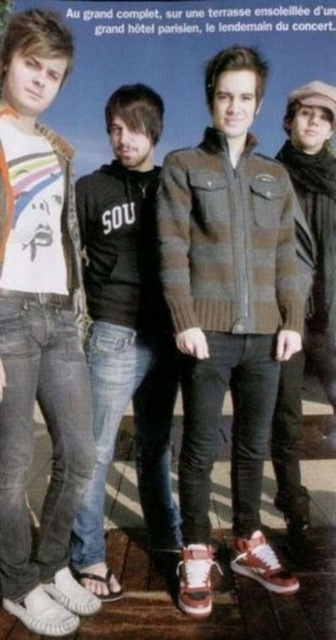
You are standing on the wooden deck and want to take a photo of both the point at (x=87, y=234) and the point at (x=315, y=333). Which point should you focus on first to ensure both are in clear view?

You should focus on point (x=87, y=234) first because it is closer to the camera than point (x=315, y=333), ensuring both points are in focus.

You are a photographer trying to capture a candid shot of the black cotton hoodie at center and the brown woolen sweater at right. Since you want to focus on the hoodie, where should you position the hoodie in the frame relative to the sweater?

The black cotton hoodie at center is below the brown woolen sweater at right, so to focus on the hoodie, position it lower in the frame than the sweater.